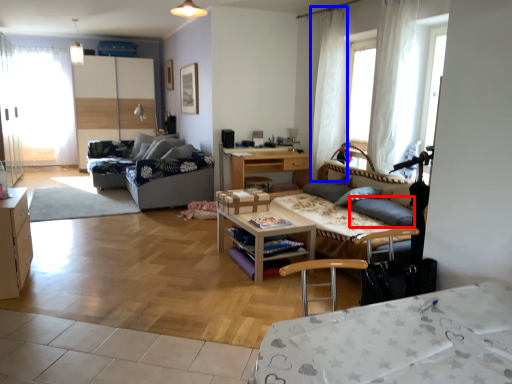
Question: Which point is further to the camera, gray (highlighted by a red box) or curtain (highlighted by a blue box)?

Choices:
 (A) gray
 (B) curtain

Answer: (B)